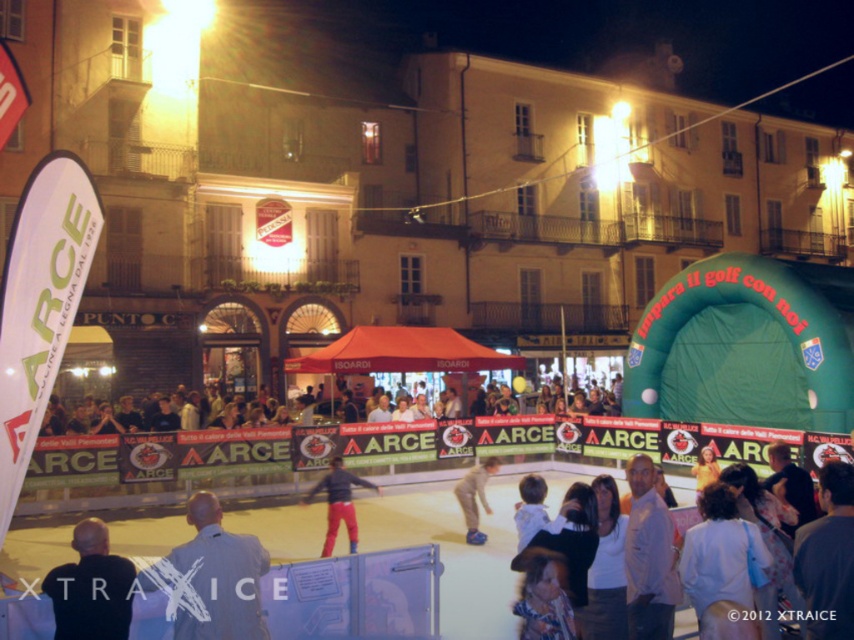
Question: Which point is closer to the camera?

Choices:
 (A) matte black tent at center
 (B) light gray shirt at center
 (C) light gray jacket at lower left

Answer: (B)

Question: Which of the following is the closest to the observer?

Choices:
 (A) light gray jacket at lower left
 (B) matte black tent at center

Answer: (A)

Question: Is light gray shirt at center wider than matte black tent at center?

Choices:
 (A) no
 (B) yes

Answer: (A)

Question: Which point is closer to the camera?

Choices:
 (A) pos(256,620)
 (B) pos(102,632)

Answer: (B)

Question: Does matte black tent at center have a smaller size compared to red pants at center?

Choices:
 (A) yes
 (B) no

Answer: (B)

Question: Does matte black tent at center have a lesser width compared to light gray jacket at lower left?

Choices:
 (A) yes
 (B) no

Answer: (B)